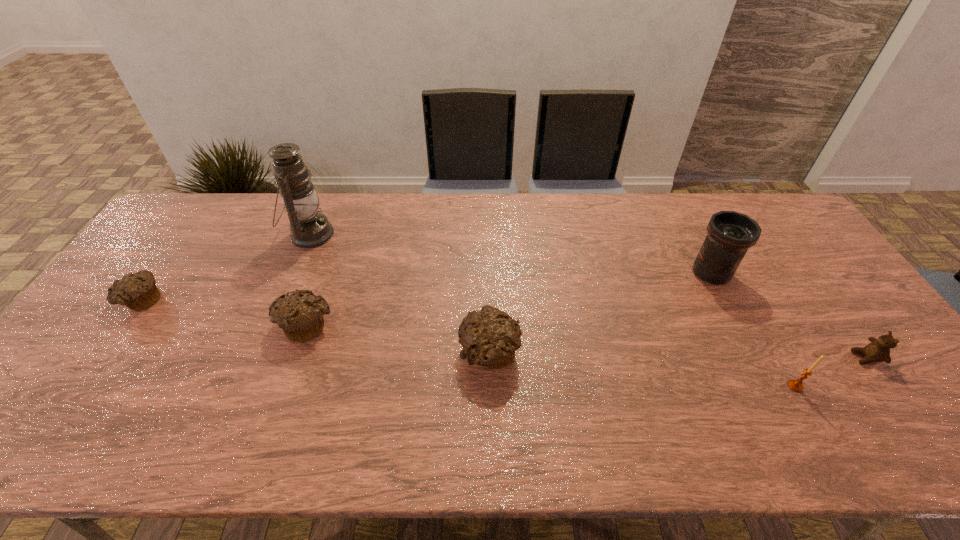
Locate which object is the fourth closest to the farthest object. Please provide its 2D coordinates. Your answer should be formatted as a tuple, i.e. [(x, y)], where the tuple contains the x and y coordinates of a point satisfying the conditions above.

[(730, 234)]

Locate an element on the screen. The height and width of the screenshot is (540, 960). muffin that is the second closest one to the second muffin from left to right is located at coordinates (138, 291).

Find the location of a particular element. This screenshot has height=540, width=960. the second closest muffin to the leftmost object is located at coordinates (490, 337).

This screenshot has width=960, height=540. I want to click on free space that satisfies the following two spatial constraints: 1. at the face of the teddy bear; 2. on the front side of the candle_holder, so click(x=886, y=386).

I want to click on vacant space that satisfies the following two spatial constraints: 1. on the front side of the candle_holder; 2. on the left side of the rightmost muffin, so click(x=490, y=386).